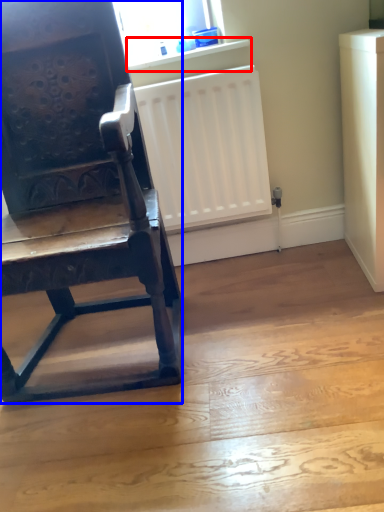
Question: Which object is closer to the camera taking this photo, window sill (highlighted by a red box) or chair (highlighted by a blue box)?

Choices:
 (A) window sill
 (B) chair

Answer: (B)